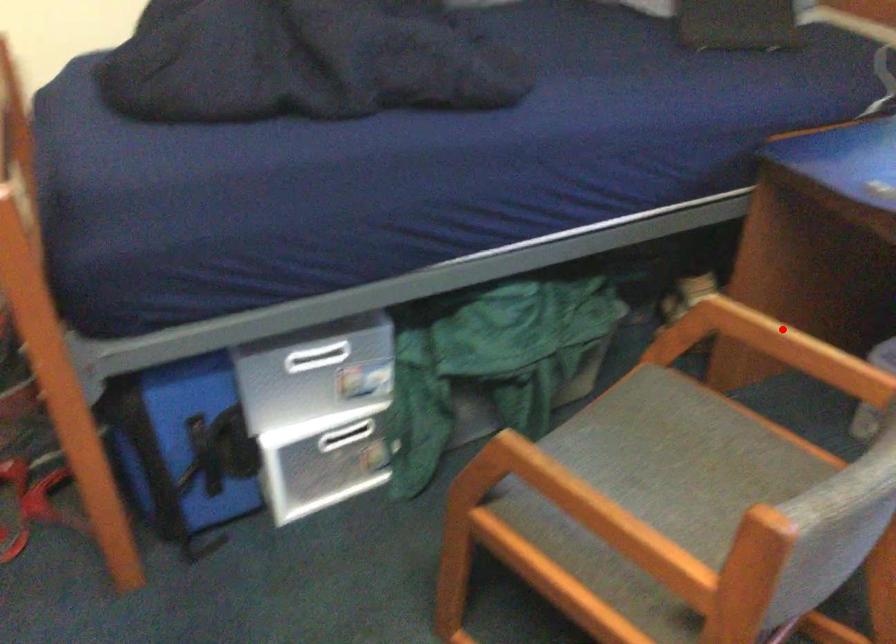
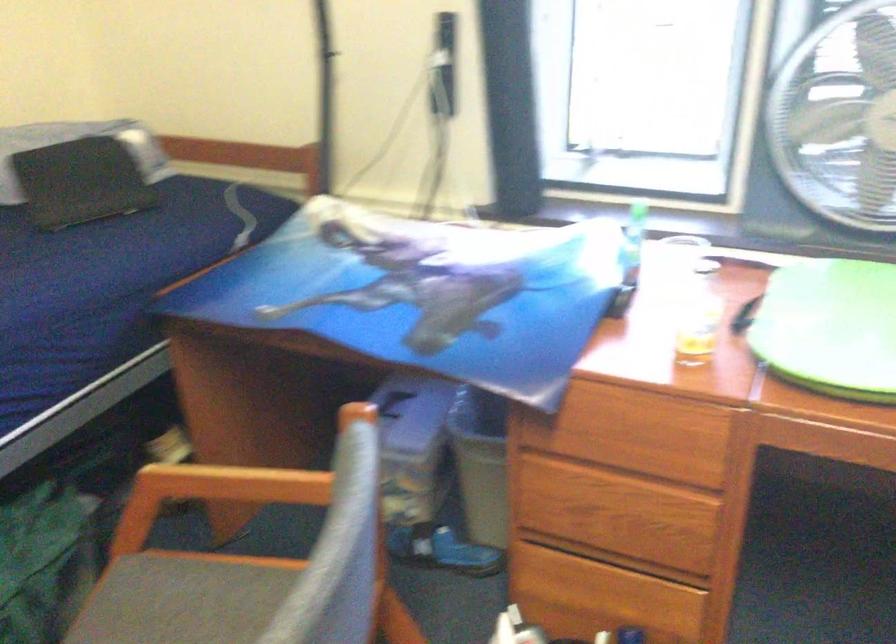
Question: I am providing you with two images of the same scene from different viewpoints. A red point is marked on the first image. At the location where the point appears in image 1, is it still visible in image 2?

Choices:
 (A) Yes
 (B) No

Answer: (B)